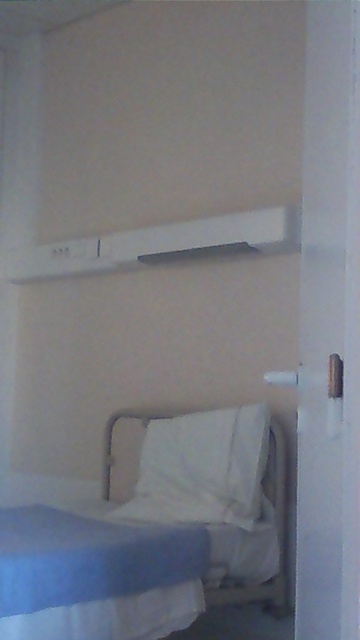
Question: Is the position of blue fabric bed at lower left less distant than that of blue soft fabric blanket at lower left?

Choices:
 (A) yes
 (B) no

Answer: (B)

Question: Is blue fabric bed at lower left positioned at the back of blue soft fabric blanket at lower left?

Choices:
 (A) yes
 (B) no

Answer: (A)

Question: Which object is the closest to the blue soft fabric blanket at lower left?

Choices:
 (A) white soft pillow at lower center
 (B) blue fabric bed at lower left

Answer: (B)

Question: Which object is positioned closest to the blue fabric bed at lower left?

Choices:
 (A) white soft pillow at lower center
 (B) blue soft fabric blanket at lower left

Answer: (B)

Question: Which of the following is the closest to the observer?

Choices:
 (A) white soft pillow at lower center
 (B) blue soft fabric blanket at lower left

Answer: (B)

Question: Can you confirm if blue fabric bed at lower left is positioned below blue soft fabric blanket at lower left?

Choices:
 (A) yes
 (B) no

Answer: (B)